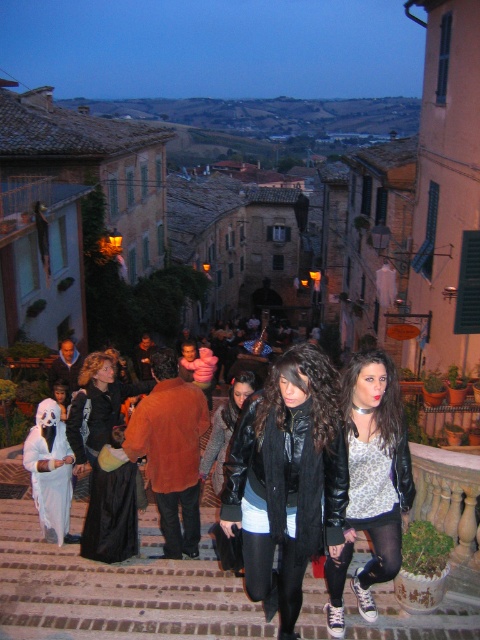
Who is more forward, (312, 534) or (64, 502)?

Point (312, 534) is in front.

Between matte black jacket at center and white matte ghost at left, which one appears on the right side from the viewer's perspective?

From the viewer's perspective, matte black jacket at center appears more on the right side.

Describe the element at coordinates (288, 477) in the screenshot. I see `matte black jacket at center` at that location.

Where is `matte black jacket at center`? matte black jacket at center is located at coordinates (288, 477).

Is point (367, 632) closer to viewer compared to point (204, 452)?

Yes, point (367, 632) is in front of point (204, 452).

Is brown brick stairs at center positioned before black leather jacket at center?

That is True.

Is point (6, 554) positioned before point (201, 476)?

That is False.

At what (x,y) coordinates should I click in order to perform the action: click on brown brick stairs at center. Please return your answer as a coordinate pair (x, y). Looking at the image, I should click on (118, 588).

Does point (103, 513) come in front of point (52, 406)?

Yes, it is in front of point (52, 406).

Between point (98, 426) and point (54, 529), which one is positioned behind?

Positioned behind is point (98, 426).

You are a GUI agent. You are given a task and a screenshot of the screen. Output one action in this format:
    pyautogui.click(x=<x>, y=<y>)
    Task: Click on the black velvet dress at center
    This screenshot has height=640, width=480.
    Given the screenshot: What is the action you would take?
    pyautogui.click(x=96, y=461)